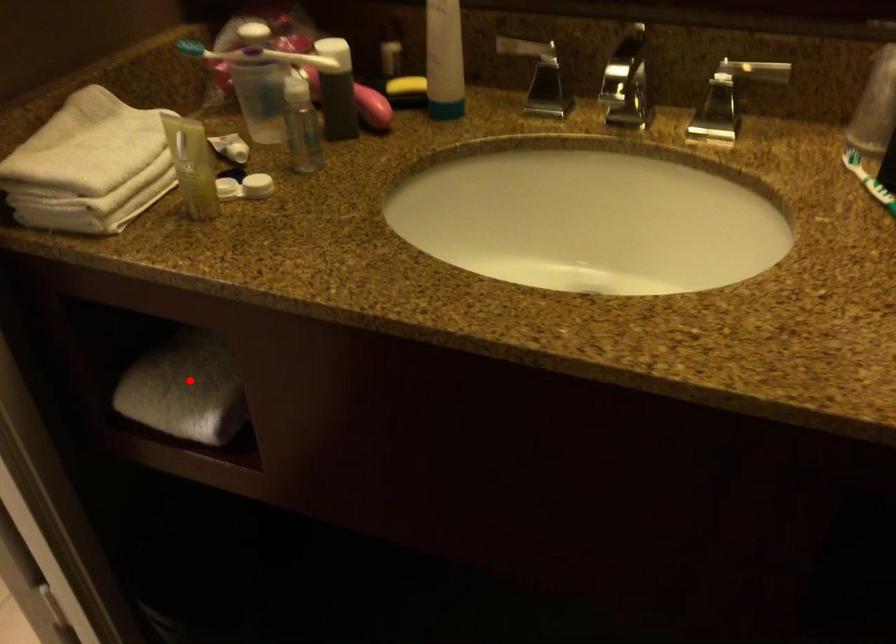
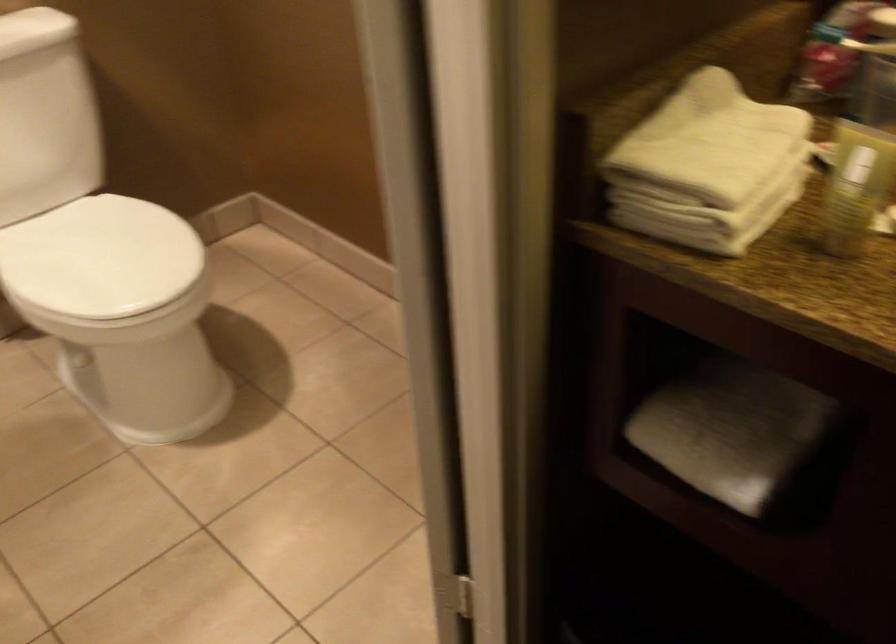
Find the pixel in the second image that matches the highlighted location in the first image.

(730, 431)